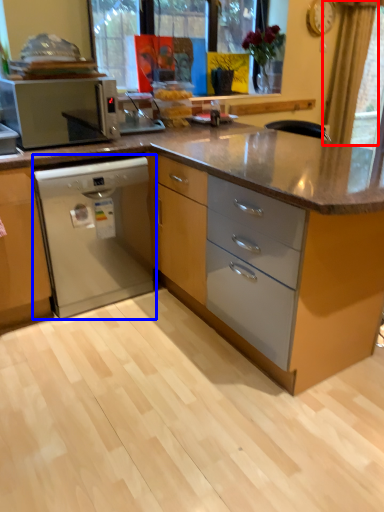
Question: Among these objects, which one is nearest to the camera, curtain (highlighted by a red box) or home appliance (highlighted by a blue box)?

Choices:
 (A) curtain
 (B) home appliance

Answer: (B)